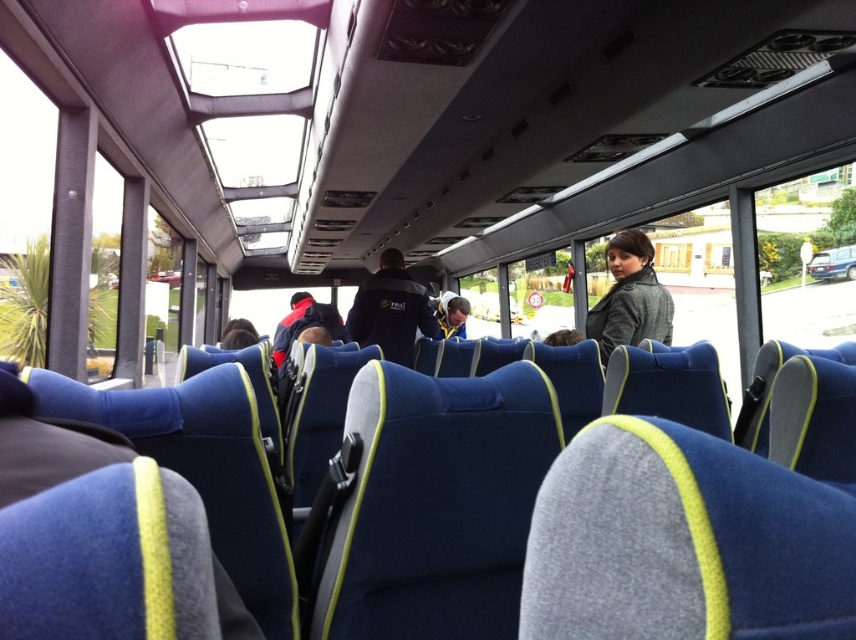
Question: Is matte black jacket at upper right to the left of dark blue fabric jacket at center from the viewer's perspective?

Choices:
 (A) yes
 (B) no

Answer: (B)

Question: Is matte black jacket at upper right above dark blue fabric jacket at center?

Choices:
 (A) yes
 (B) no

Answer: (B)

Question: Which object appears closest to the camera in this image?

Choices:
 (A) matte black jacket at upper right
 (B) dark blue fabric jacket at center

Answer: (A)

Question: Can you confirm if matte black jacket at upper right is thinner than dark blue fabric jacket at center?

Choices:
 (A) yes
 (B) no

Answer: (A)